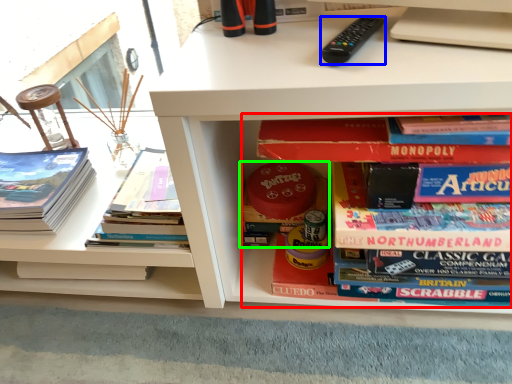
Question: Considering the real-world distances, which object is closest to book (highlighted by a red box)? remote control (highlighted by a blue box) or book (highlighted by a green box).

Choices:
 (A) remote control
 (B) book

Answer: (A)